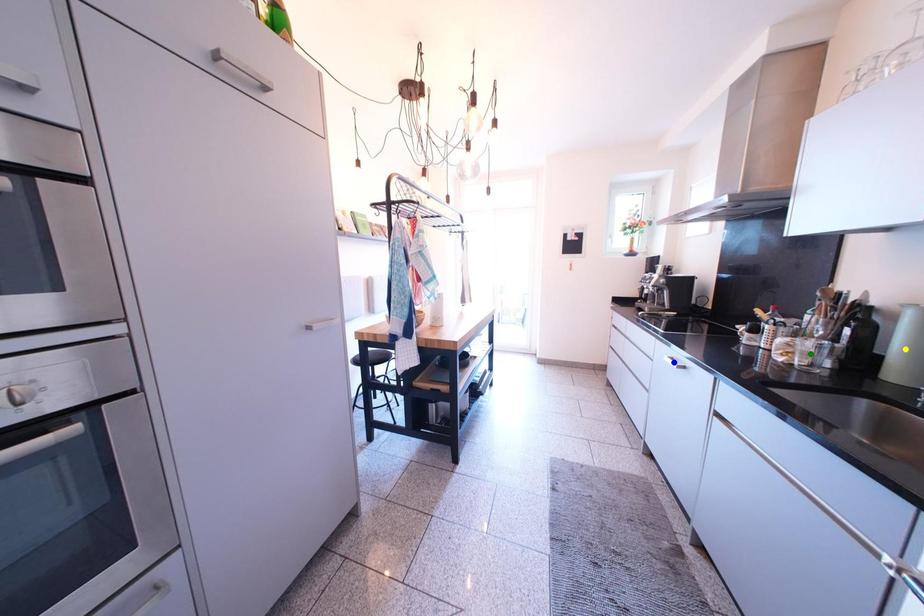
Order these from nearest to farthest:
green point | yellow point | blue point

yellow point < green point < blue point